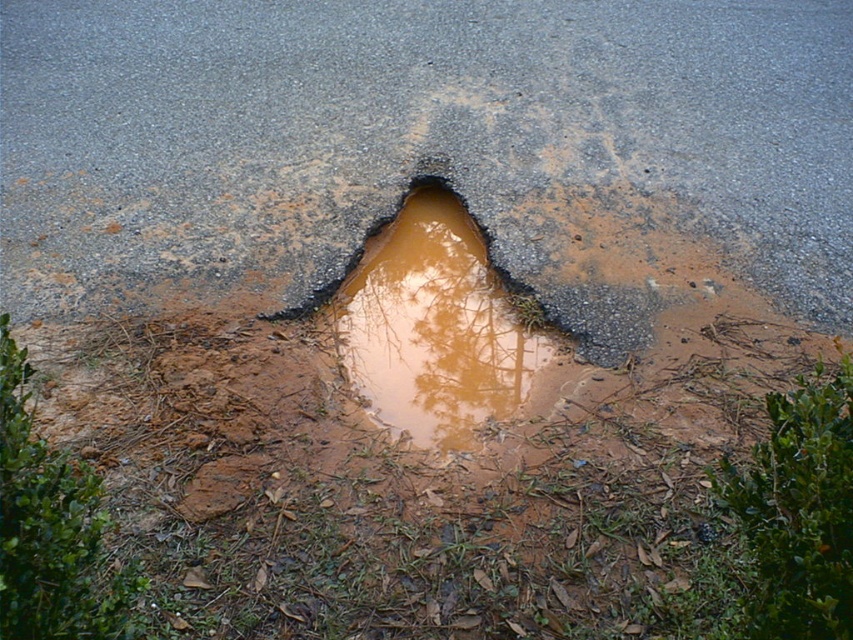
Measure the distance from green leafy bush at lower right to green leafy tree at lower left.

The distance of green leafy bush at lower right from green leafy tree at lower left is 3.62 feet.

Can you confirm if green leafy bush at lower right is positioned to the right of green leafy tree at lower left?

Correct, you'll find green leafy bush at lower right to the right of green leafy tree at lower left.

Does point (808, 442) come behind point (55, 618)?

Yes, it is behind point (55, 618).

Locate an element on the screen. green leafy bush at lower right is located at coordinates (793, 515).